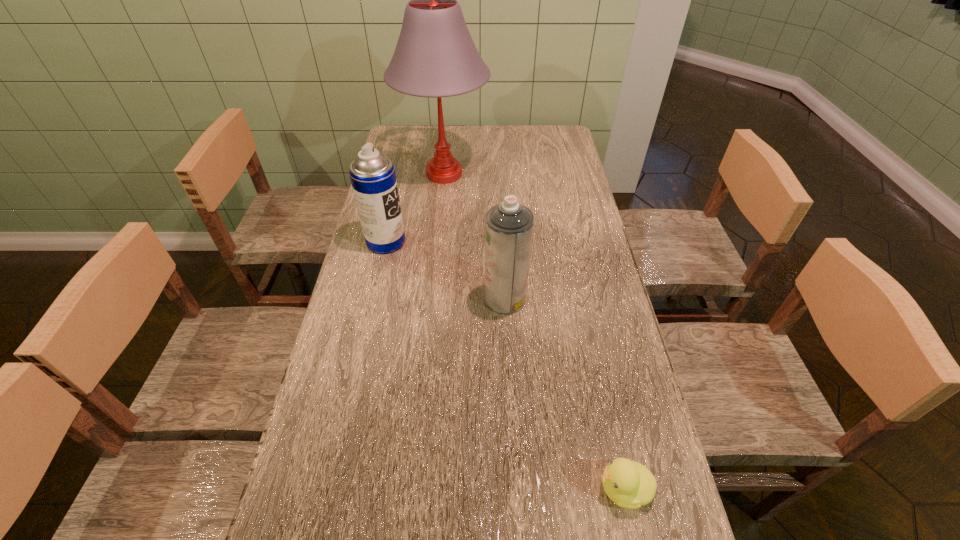
Identify the location of free region located 0.200m on the label side of the farther aerosol can. (468, 241).

Locate an element on the screen. The width and height of the screenshot is (960, 540). vacant area situated 0.050m at the beak of the nearest object is located at coordinates (572, 488).

The width and height of the screenshot is (960, 540). Identify the location of free space located at the beak of the nearest object. coord(462,488).

You are a GUI agent. You are given a task and a screenshot of the screen. Output one action in this format:
    pyautogui.click(x=<x>, y=<y>)
    Task: Click on the free location located at the beak of the nearest object
    
    Given the screenshot: What is the action you would take?
    pyautogui.click(x=516, y=488)

Locate an element on the screen. The image size is (960, 540). object that is at the far edge is located at coordinates (435, 56).

Locate an element on the screen. This screenshot has width=960, height=540. table lamp that is at the left edge is located at coordinates coord(435,56).

This screenshot has width=960, height=540. In order to click on aerosol can that is at the left edge in this screenshot , I will do `click(372, 174)`.

Locate an element on the screen. Image resolution: width=960 pixels, height=540 pixels. object positioned at the right edge is located at coordinates (629, 484).

Locate an element on the screen. The width and height of the screenshot is (960, 540). object situated at the far left corner is located at coordinates (435, 56).

Identify the location of vacant space at the far edge of the desktop. This screenshot has width=960, height=540. (474, 131).